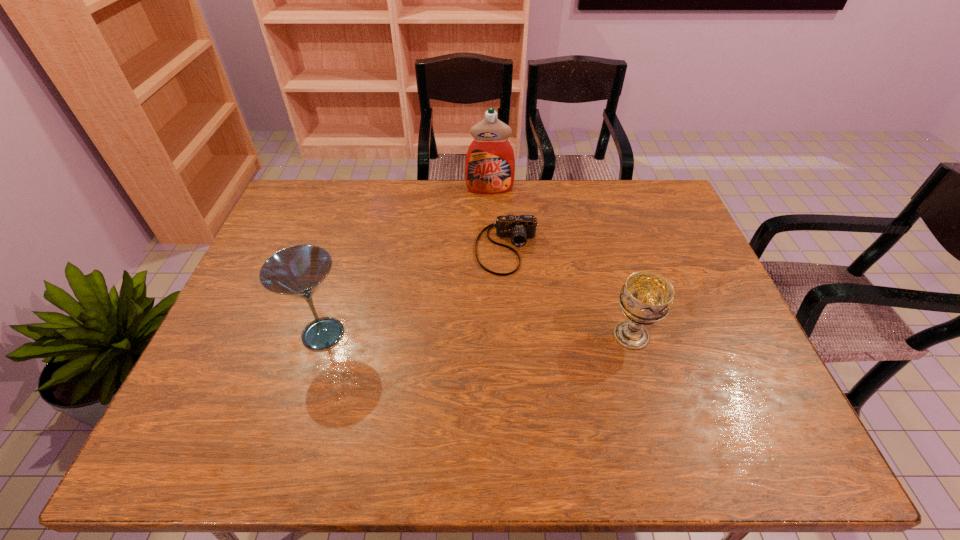
Select which object is the third closest to the rightmost object. Please provide its 2D coordinates. Your answer should be formatted as a tuple, i.e. [(x, y)], where the tuple contains the x and y coordinates of a point satisfying the conditions above.

[(298, 271)]

This screenshot has width=960, height=540. I want to click on the second closest object to the detergent, so click(x=645, y=298).

Identify the location of blank area in the image that satisfies the following two spatial constraints: 1. on the front side of the rightmost object; 2. on the left side of the detergent. This screenshot has width=960, height=540. (493, 335).

You are a GUI agent. You are given a task and a screenshot of the screen. Output one action in this format:
    pyautogui.click(x=<x>, y=<y>)
    Task: Click on the vacant space that satisfies the following two spatial constraints: 1. on the front side of the rightmost object; 2. on the right side of the farthest object
    This screenshot has width=960, height=540.
    Given the screenshot: What is the action you would take?
    pyautogui.click(x=493, y=335)